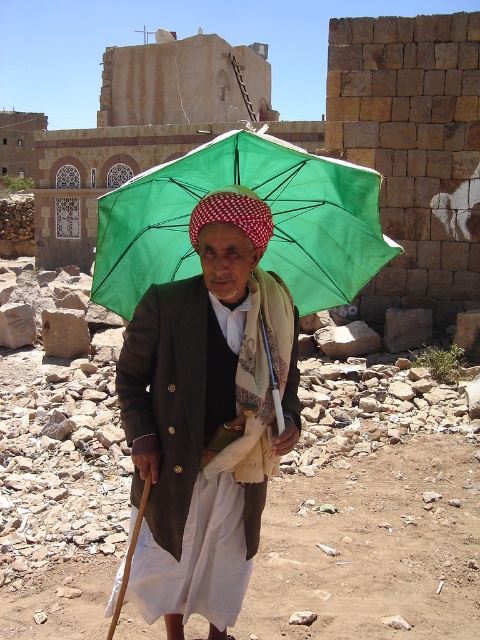
Who is taller, matte green umbrella at center or green fabric umbrella at center?

green fabric umbrella at center is taller.

Consider the image. Can you confirm if matte green umbrella at center is thinner than green fabric umbrella at center?

Correct, matte green umbrella at center's width is less than green fabric umbrella at center's.

Measure the distance between matte green umbrella at center and camera.

matte green umbrella at center is 7.47 meters from camera.

The image size is (480, 640). What are the coordinates of `matte green umbrella at center` in the screenshot? It's located at (206, 416).

Looking at this image, can you confirm if matte green umbrella at center is thinner than green fabric umbrella at upper center?

No.

Is point (189, 380) more distant than point (220, 285)?

No, it is in front of (220, 285).

Between point (160, 428) and point (219, 292), which one is positioned behind?

The point (160, 428) is behind.

Where is `matte green umbrella at center`? The image size is (480, 640). matte green umbrella at center is located at coordinates (206, 416).

Who is more distant from viewer, (124, 284) or (222, 252)?

The point (124, 284) is behind.

Find the location of `green fabric umbrella at center`. green fabric umbrella at center is located at coordinates (272, 218).